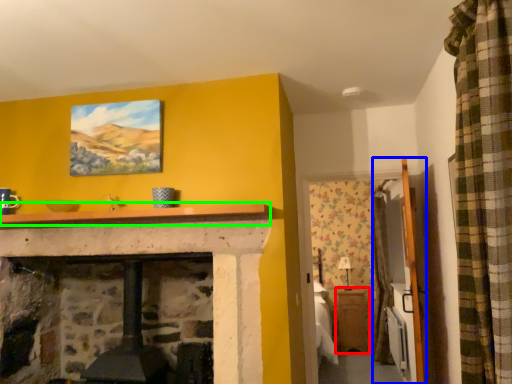
Question: Which is farther away from table (highlighted by a red box)? armoire (highlighted by a blue box) or mantle (highlighted by a green box)?

Choices:
 (A) armoire
 (B) mantle

Answer: (B)